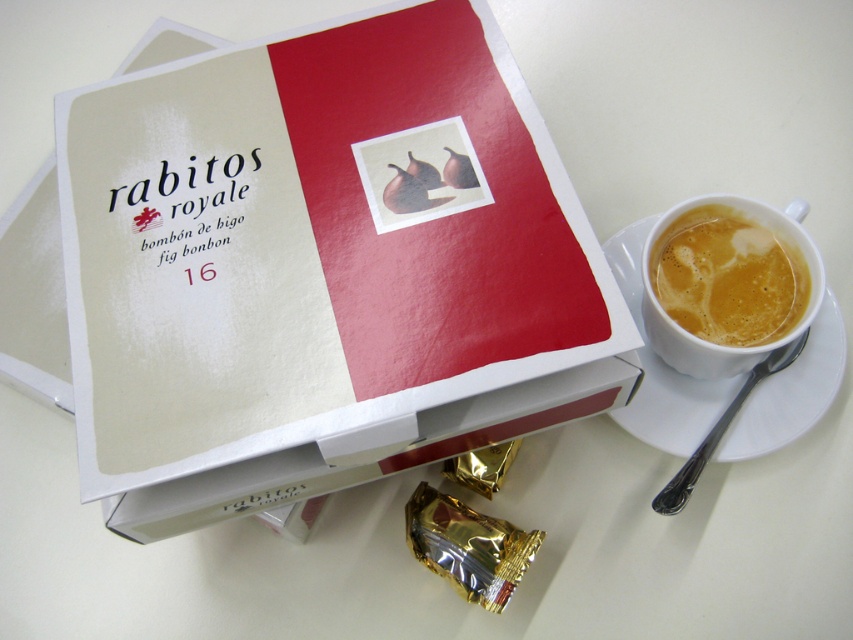
Does white ceramic saucer at right appear under white frothy liquid at upper right?

Indeed, white ceramic saucer at right is positioned under white frothy liquid at upper right.

Find the location of `white ceramic saucer at right`. white ceramic saucer at right is located at coordinates (662, 365).

How far apart are white paper book at upper center and white ceramic saucer at right?

A distance of 14.89 inches exists between white paper book at upper center and white ceramic saucer at right.

Does white paper book at upper center appear on the left side of white ceramic saucer at right?

Indeed, white paper book at upper center is positioned on the left side of white ceramic saucer at right.

Between point (280, 400) and point (714, 452), which one is positioned in front?

Point (280, 400)

Where is `white paper book at upper center`? The width and height of the screenshot is (853, 640). white paper book at upper center is located at coordinates (318, 272).

Is white paper book at upper center below white frothy liquid at upper right?

Incorrect, white paper book at upper center is not positioned below white frothy liquid at upper right.

Is white paper book at upper center in front of white frothy liquid at upper right?

That is True.

Measure the distance between point (212, 157) and camera.

33.99 inches

Find the location of a particular element. Image resolution: width=853 pixels, height=640 pixels. white paper book at upper center is located at coordinates (318, 272).